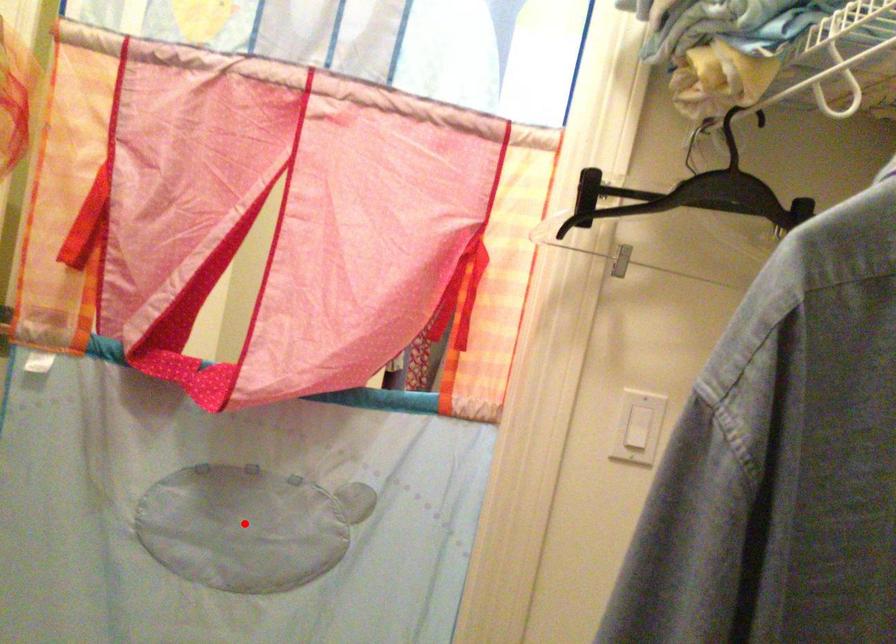
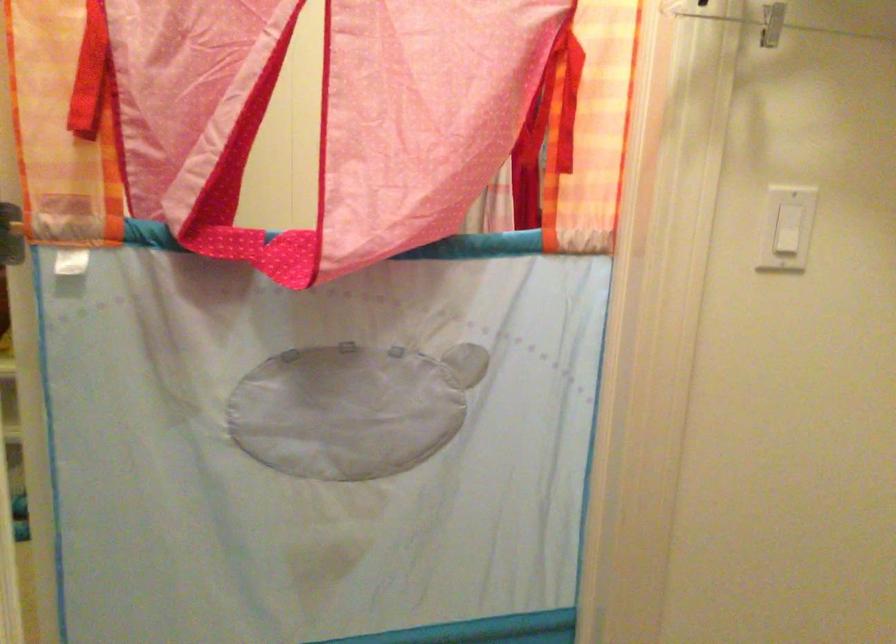
Question: I am providing you with two images of the same scene from different viewpoints. A red point is shown in image1. For the corresponding object point in image2, is it positioned nearer or farther from the camera?

Choices:
 (A) Nearer
 (B) Farther

Answer: (A)